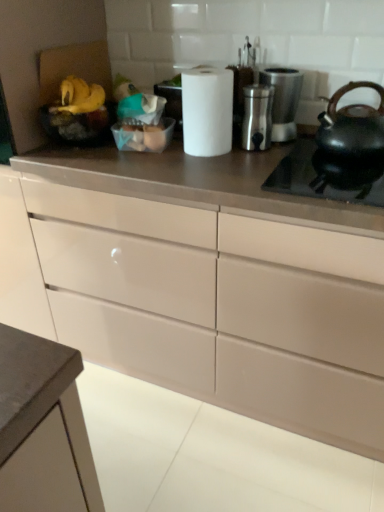
The width and height of the screenshot is (384, 512). Find the location of `free space in front of satin silver container at center, the 1th appliance from the left`. free space in front of satin silver container at center, the 1th appliance from the left is located at coordinates (263, 164).